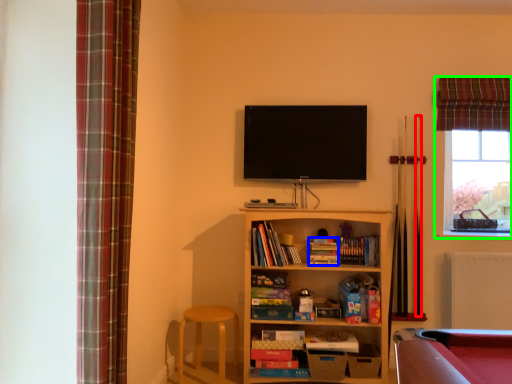
Question: Which object is positioned closest to cue (highlighted by a red box)? Select from book (highlighted by a blue box) and window (highlighted by a green box).

Choices:
 (A) book
 (B) window

Answer: (B)